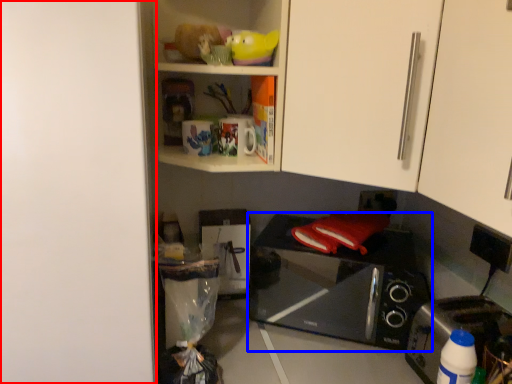
Question: Which object appears closest to the camera in this image, door (highlighted by a red box) or microwave oven (highlighted by a blue box)?

Choices:
 (A) door
 (B) microwave oven

Answer: (A)